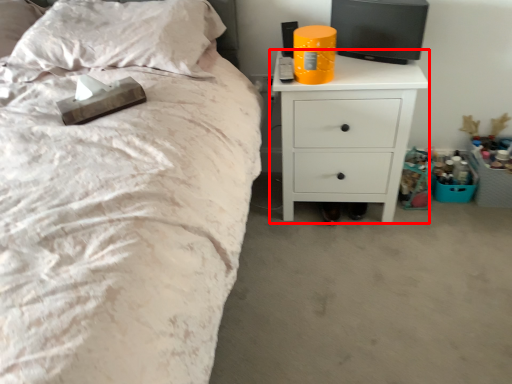
Question: From the image's perspective, what is the correct spatial positioning of nightstand (annotated by the red box) in reference to pillow?

Choices:
 (A) above
 (B) below

Answer: (B)